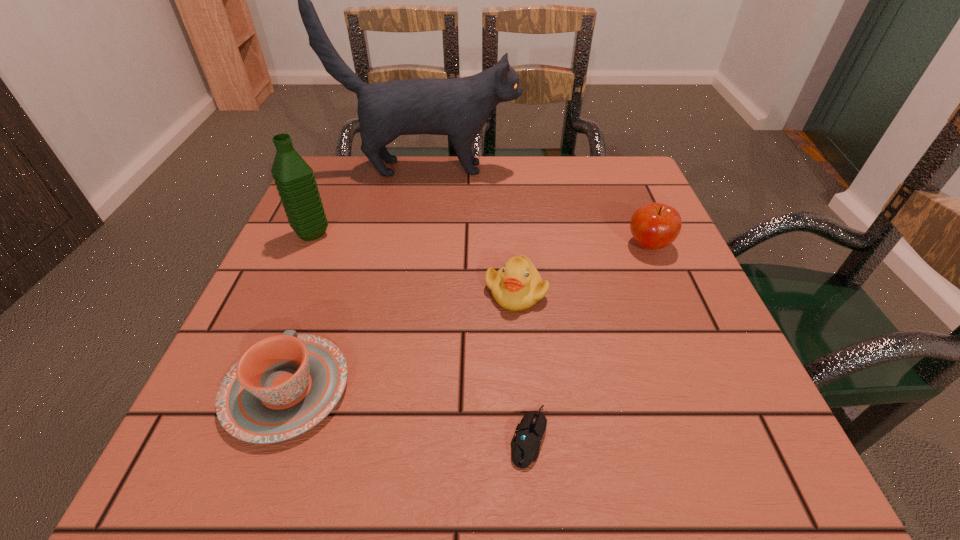
In order to click on vacant area situated 0.250m at the face of the duckling in this screenshot , I will do `click(529, 452)`.

You are a GUI agent. You are given a task and a screenshot of the screen. Output one action in this format:
    pyautogui.click(x=<x>, y=<y>)
    Task: Click on the free space located 0.300m on the handle side of the second shortest object
    
    Given the screenshot: What is the action you would take?
    pyautogui.click(x=345, y=230)

In order to click on free spot located on the handle side of the second shortest object in this screenshot , I will do `click(349, 215)`.

Find the location of `vacant space located on the handle side of the second shortest object`. vacant space located on the handle side of the second shortest object is located at coordinates (348, 221).

Where is `vacant space located 0.250m on the left of the shortest object`? vacant space located 0.250m on the left of the shortest object is located at coordinates (330, 437).

Locate an element on the screen. This screenshot has height=540, width=960. object that is at the far edge is located at coordinates (459, 107).

Locate an element on the screen. chinaware located in the near edge section of the desktop is located at coordinates (284, 385).

The width and height of the screenshot is (960, 540). Identify the location of computer mouse that is at the near edge. (525, 445).

Find the location of `cat situated at the left edge`. cat situated at the left edge is located at coordinates (459, 107).

At what (x,y) coordinates should I click in order to perform the action: click on water bottle present at the left edge. Please return your answer as a coordinate pair (x, y). Image resolution: width=960 pixels, height=540 pixels. Looking at the image, I should click on (294, 178).